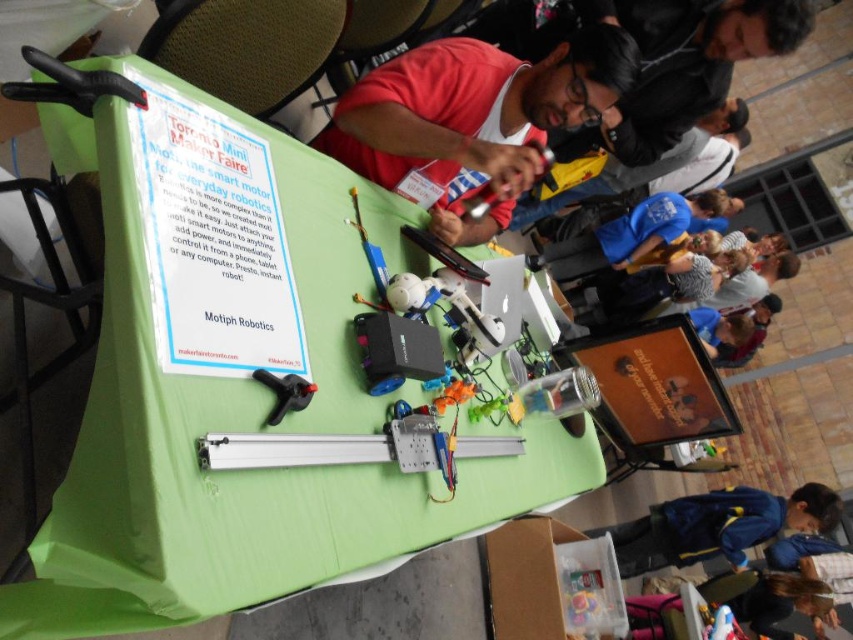
Between orange matte signboard at center and blue fabric jacket at lower right, which one appears on the right side from the viewer's perspective?

blue fabric jacket at lower right is more to the right.

Does point (639, 420) come closer to viewer compared to point (630, 548)?

Yes, point (639, 420) is in front of point (630, 548).

This screenshot has height=640, width=853. What do you see at coordinates (653, 385) in the screenshot? I see `orange matte signboard at center` at bounding box center [653, 385].

I want to click on orange matte signboard at center, so click(653, 385).

Is black plastic tool at center thinner than matte black laptop at center?

Yes, black plastic tool at center is thinner than matte black laptop at center.

Between point (277, 401) and point (427, 230), which one is positioned behind?

The point (427, 230) is behind.

Between point (270, 420) and point (447, 250), which one is positioned in front?

Point (270, 420)

Where is `black plastic tool at center`? black plastic tool at center is located at coordinates (283, 394).

Can you confirm if blue fabric jacket at lower right is wider than matte black laptop at center?

Indeed, blue fabric jacket at lower right has a greater width compared to matte black laptop at center.

Who is positioned more to the left, blue fabric jacket at lower right or matte black laptop at center?

matte black laptop at center is more to the left.

The width and height of the screenshot is (853, 640). What do you see at coordinates (717, 525) in the screenshot?
I see `blue fabric jacket at lower right` at bounding box center [717, 525].

Find the location of a particular element. The image size is (853, 640). blue fabric jacket at lower right is located at coordinates tap(717, 525).